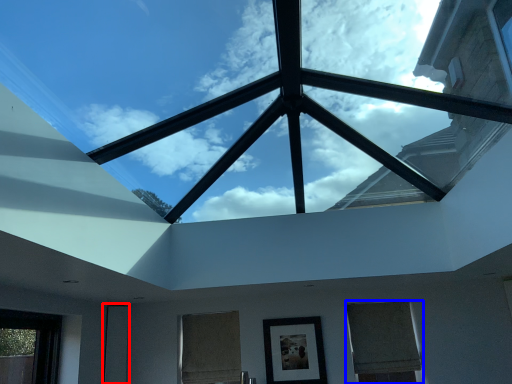
Question: Which object is closer to the camera taking this photo, glass door (highlighted by a red box) or window (highlighted by a blue box)?

Choices:
 (A) glass door
 (B) window

Answer: (B)